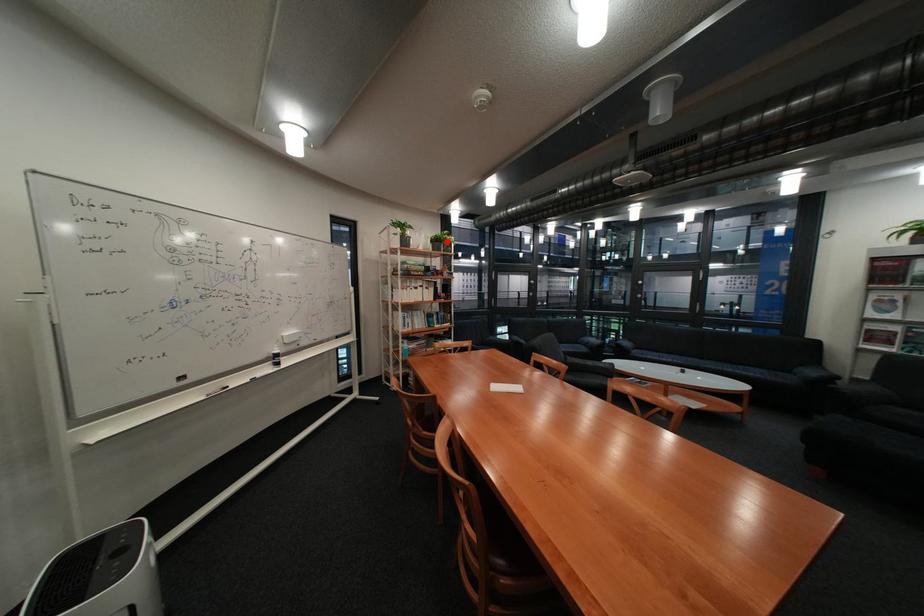
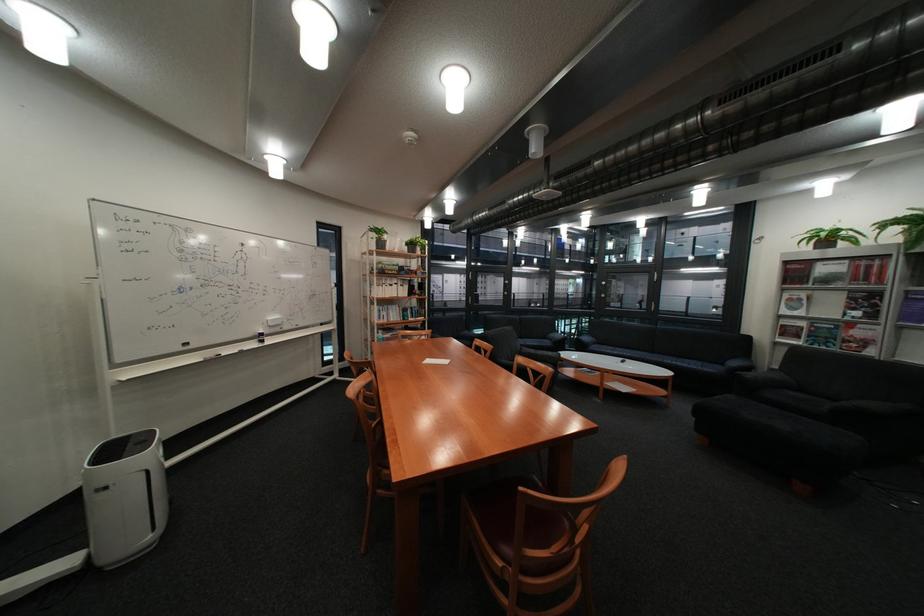
The point at the highlighted location is marked in the first image. Where is the corresponding point in the second image?

(421, 245)